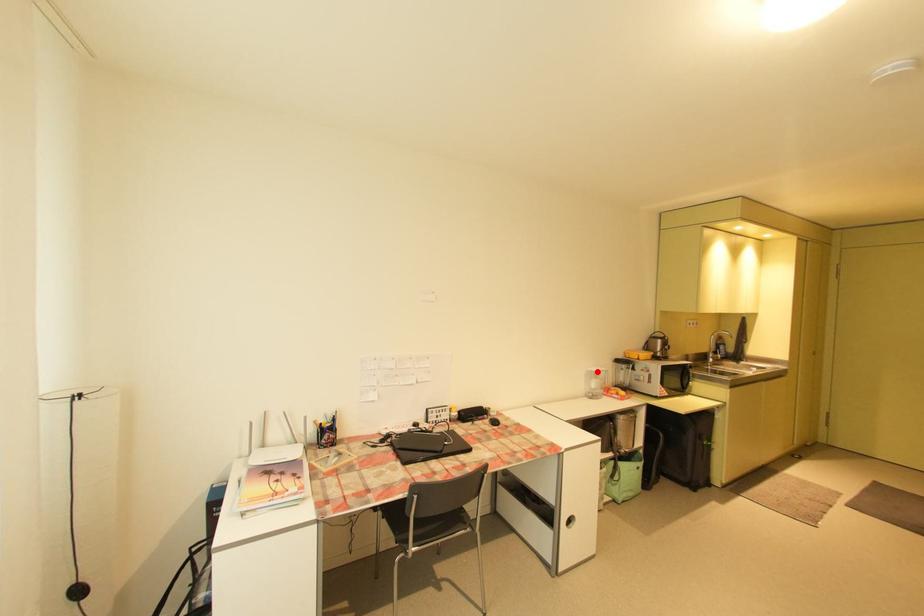
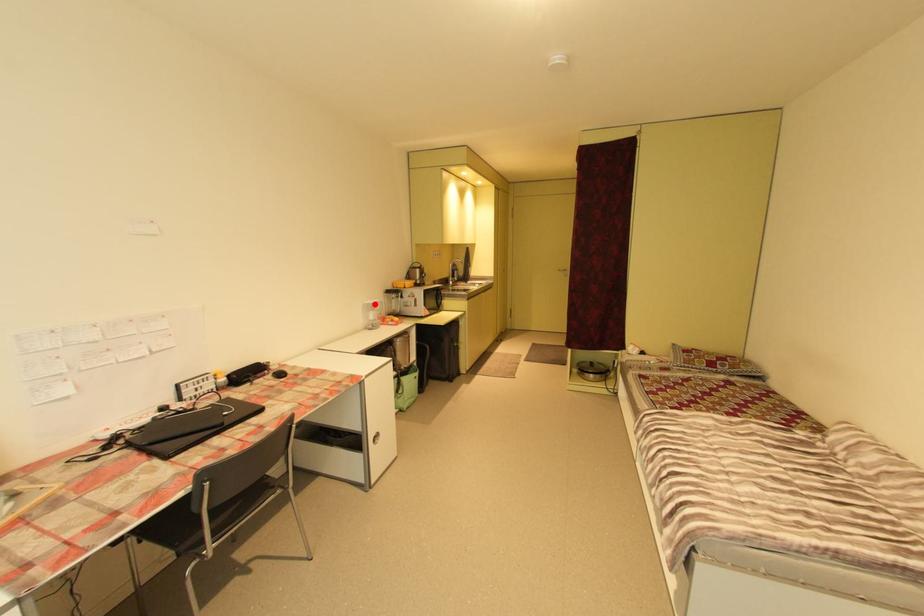
I am providing you with two images of the same scene from different viewpoints. A red point is marked on the first image and another point is marked on the second image. Are the points marked in image1 and image2 representing the same 3D position?

Yes